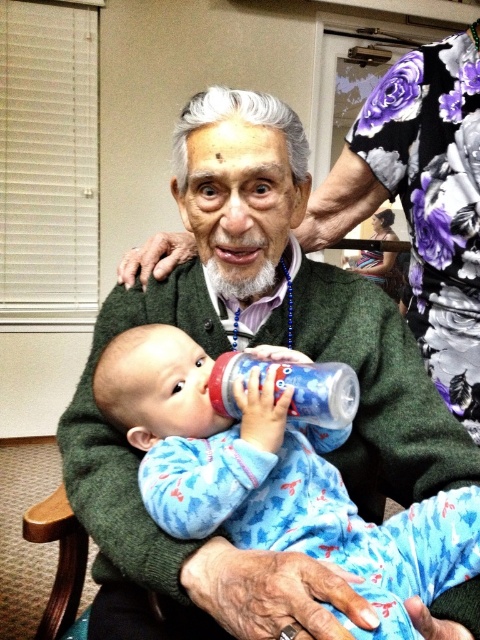
Question: Can you confirm if floral fabric at upper right is thinner than blue plastic bottle at center?

Choices:
 (A) no
 (B) yes

Answer: (A)

Question: Does blue fleece onesie at center come behind floral fabric at upper right?

Choices:
 (A) yes
 (B) no

Answer: (B)

Question: Which point is farther from the camera taking this photo?

Choices:
 (A) click(x=343, y=400)
 (B) click(x=446, y=276)

Answer: (B)

Question: Which point is farther to the camera?

Choices:
 (A) (110, 369)
 (B) (392, 125)

Answer: (B)

Question: Does blue fleece onesie at center have a smaller size compared to floral fabric at upper right?

Choices:
 (A) yes
 (B) no

Answer: (A)

Question: Which object is positioned closest to the floral fabric at upper right?

Choices:
 (A) blue fleece onesie at center
 (B) blue plastic bottle at center

Answer: (A)